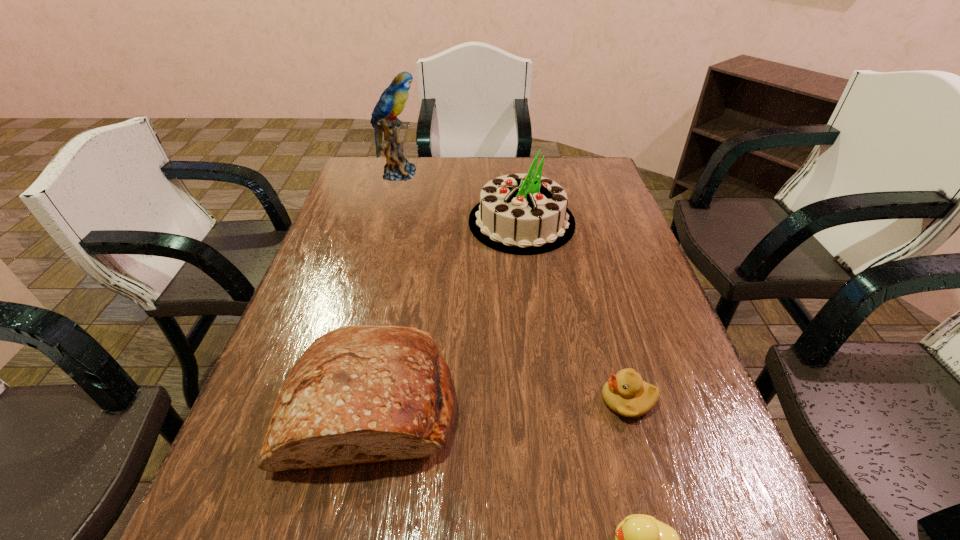
Locate which object ranks in proximity to the tallest object. Please provide its 2D coordinates. Your answer should be formatted as a tuple, i.e. [(x, y)], where the tuple contains the x and y coordinates of a point satisfying the conditions above.

[(522, 214)]

In order to click on free point that satisfies the following two spatial constraints: 1. on the front-facing side of the farther duckling; 2. at the sliced front of the bread in this screenshot , I will do `click(629, 404)`.

What are the coordinates of `free spot that satisfies the following two spatial constraints: 1. on the front-facing side of the farther duckling; 2. at the sliced front of the bread` in the screenshot? It's located at (629, 404).